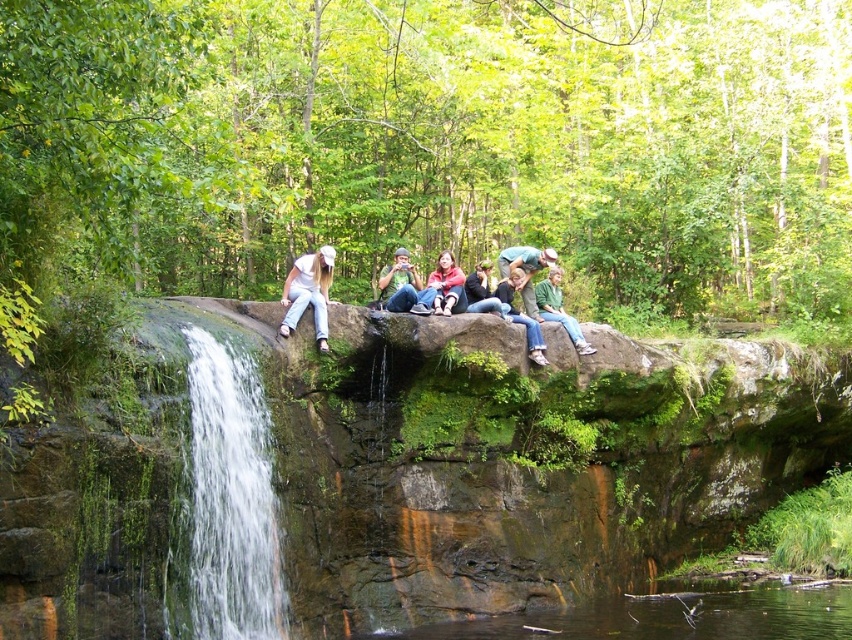
Image resolution: width=852 pixels, height=640 pixels. Identify the location of clear water at center. (229, 497).

Is clear water at center shorter than matte pink sweater at center?

Incorrect, clear water at center's height does not fall short of matte pink sweater at center's.

Which is in front, point (194, 486) or point (440, 253)?

Point (194, 486) is more forward.

The height and width of the screenshot is (640, 852). Find the location of `clear water at center`. clear water at center is located at coordinates (229, 497).

Is matte pink sweater at center above jeans at center?

Correct, matte pink sweater at center is located above jeans at center.

Which is in front, point (436, 310) or point (511, 321)?

Point (436, 310)

This screenshot has height=640, width=852. In order to click on matte pink sweater at center in this screenshot , I will do `click(446, 285)`.

At what (x,y) coordinates should I click in order to perform the action: click on matte pink sweater at center. Please return your answer as a coordinate pair (x, y). This screenshot has width=852, height=640. Looking at the image, I should click on pyautogui.click(x=446, y=285).

Who is taller, white denim jeans at center or matte blue jeans at center?

Standing taller between the two is matte blue jeans at center.

Which is above, white denim jeans at center or matte blue jeans at center?

matte blue jeans at center is higher up.

Who is more distant from viewer, (286, 289) or (389, 292)?

The point (389, 292) is behind.

At what (x,y) coordinates should I click in order to perform the action: click on white denim jeans at center. Please return your answer as a coordinate pair (x, y). The width and height of the screenshot is (852, 640). Looking at the image, I should click on (308, 292).